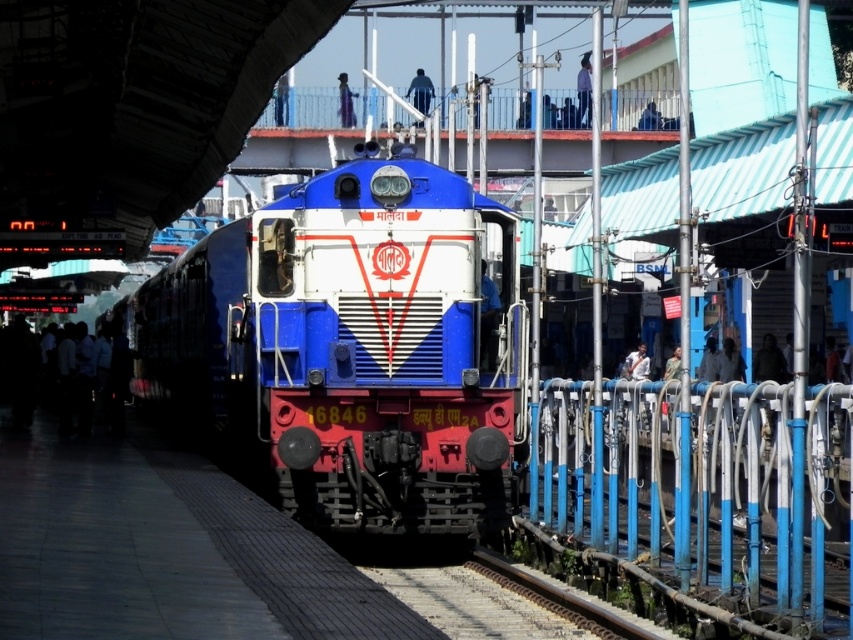
Can you confirm if matte black person at upper center is smaller than camouflage fabric shirt at right?

Correct, matte black person at upper center occupies less space than camouflage fabric shirt at right.

Is matte black person at upper center closer to camera compared to camouflage fabric shirt at right?

No, it is behind camouflage fabric shirt at right.

You are a GUI agent. You are given a task and a screenshot of the screen. Output one action in this format:
    pyautogui.click(x=<x>, y=<y>)
    Task: Click on the matte black person at upper center
    
    Given the screenshot: What is the action you would take?
    pyautogui.click(x=648, y=116)

Can you confirm if blue painted metal pole at right is thinner than white fabric shirt at center?

In fact, blue painted metal pole at right might be wider than white fabric shirt at center.

Between blue painted metal pole at right and white fabric shirt at center, which one appears on the right side from the viewer's perspective?

blue painted metal pole at right is more to the right.

Is point (689, 435) positioned in front of point (639, 364)?

Yes, point (689, 435) is in front of point (639, 364).

You are a GUI agent. You are given a task and a screenshot of the screen. Output one action in this format:
    pyautogui.click(x=<x>, y=<y>)
    Task: Click on the blue painted metal pole at right
    
    Given the screenshot: What is the action you would take?
    pyautogui.click(x=683, y=310)

Can you confirm if metallic pole at right is shorter than white fabric shirt at center?

No.

The height and width of the screenshot is (640, 853). Describe the element at coordinates (799, 314) in the screenshot. I see `metallic pole at right` at that location.

At what (x,y) coordinates should I click in order to perform the action: click on metallic pole at right. Please return your answer as a coordinate pair (x, y). Image resolution: width=853 pixels, height=640 pixels. Looking at the image, I should click on (799, 314).